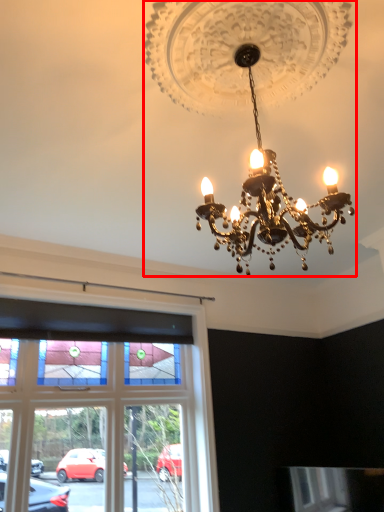
Question: From the image's perspective, considering the relative positions of lamp (annotated by the red box) and window in the image provided, where is lamp (annotated by the red box) located with respect to the staircase?

Choices:
 (A) above
 (B) below

Answer: (A)